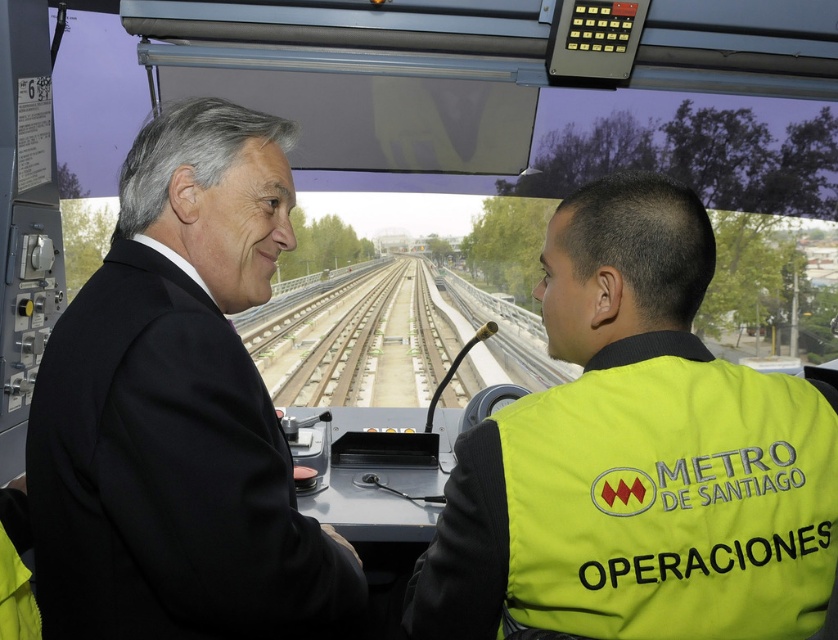
Question: Is black suit at left thinner than yellow reflective fabric safety vest at center?

Choices:
 (A) no
 (B) yes

Answer: (A)

Question: Which object is the farthest from the black suit at left?

Choices:
 (A) green concrete track at center
 (B) yellow reflective fabric safety vest at center

Answer: (A)

Question: Can you confirm if yellow reflective fabric safety vest at center is bigger than green concrete track at center?

Choices:
 (A) no
 (B) yes

Answer: (A)

Question: Based on their relative distances, which object is nearer to the black suit at left?

Choices:
 (A) green concrete track at center
 (B) yellow reflective fabric safety vest at center

Answer: (B)

Question: Among these points, which one is farthest from the camera?

Choices:
 (A) (572, 515)
 (B) (96, 492)
 (C) (330, 358)

Answer: (C)

Question: Is black suit at left to the left of yellow reflective fabric safety vest at center from the viewer's perspective?

Choices:
 (A) yes
 (B) no

Answer: (A)